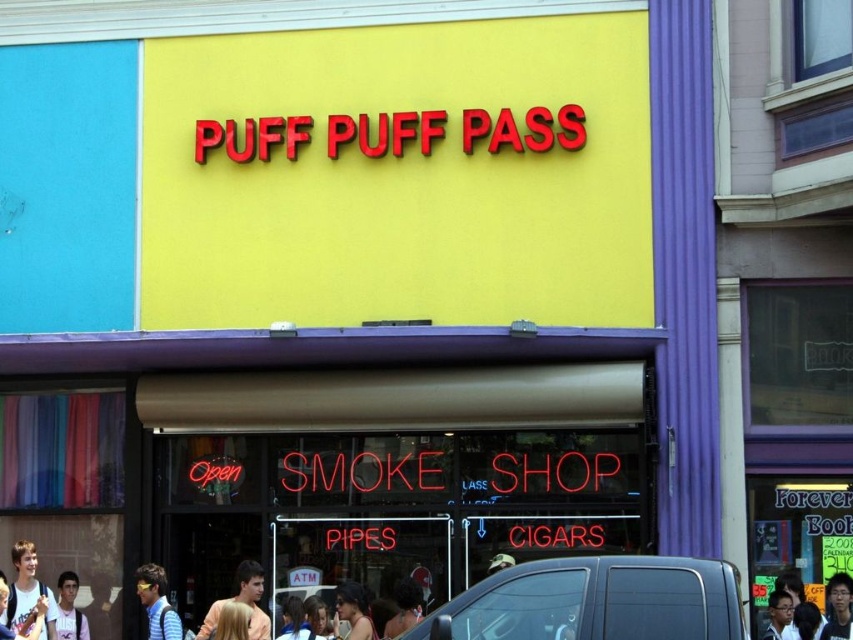
Is point (363, 634) in front of point (73, 596)?

Yes, point (363, 634) is in front of point (73, 596).

Which is in front, point (337, 637) or point (76, 614)?

Point (337, 637)

The height and width of the screenshot is (640, 853). I want to click on smooth skin face at center, so click(354, 611).

From the picture: Can you confirm if black glossy van at lower center is positioned to the right of matte gray backpack at lower left?

Indeed, black glossy van at lower center is positioned on the right side of matte gray backpack at lower left.

Is black glossy van at lower center thinner than matte gray backpack at lower left?

In fact, black glossy van at lower center might be wider than matte gray backpack at lower left.

Does point (727, 598) lie in front of point (71, 602)?

Yes, point (727, 598) is closer to viewer.

You are a GUI agent. You are given a task and a screenshot of the screen. Output one action in this format:
    pyautogui.click(x=<x>, y=<y>)
    Task: Click on the black glossy van at lower center
    This screenshot has width=853, height=640.
    Given the screenshot: What is the action you would take?
    pyautogui.click(x=595, y=602)

Which is behind, point (251, 593) or point (837, 588)?

Point (251, 593)

Is point (257, 563) positioned after point (828, 627)?

Yes, point (257, 563) is behind point (828, 627).

You are a GUI agent. You are given a task and a screenshot of the screen. Output one action in this format:
    pyautogui.click(x=<x>, y=<y>)
    Task: Click on the blonde hair at center
    
    Given the screenshot: What is the action you would take?
    pyautogui.click(x=242, y=602)